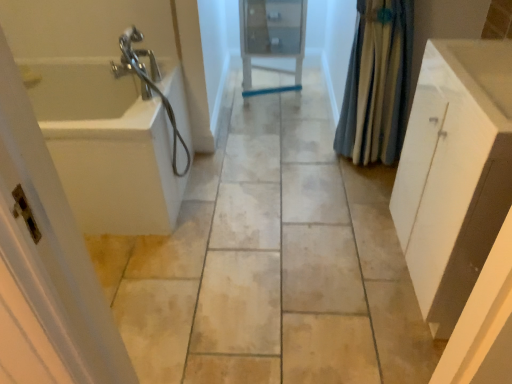
Question: Is matte glass medicine cabinet at center inside the boundaries of white matte cabinet at right, or outside?

Choices:
 (A) inside
 (B) outside

Answer: (B)

Question: Visually, is matte glass medicine cabinet at center positioned to the left or to the right of white matte cabinet at right?

Choices:
 (A) right
 (B) left

Answer: (B)

Question: Estimate the real-world distances between objects in this image. Which object is closer to the white glossy bathtub at left?

Choices:
 (A) white plastic screen door at left
 (B) white glossy sink at right
 (C) matte glass medicine cabinet at center
 (D) white matte cabinet at right
 (E) blue fabric shower curtain at right

Answer: (C)

Question: Which object is positioned closest to the blue fabric shower curtain at right?

Choices:
 (A) white matte cabinet at right
 (B) white glossy bathtub at left
 (C) white glossy sink at right
 (D) matte glass medicine cabinet at center
 (E) white plastic screen door at left

Answer: (C)